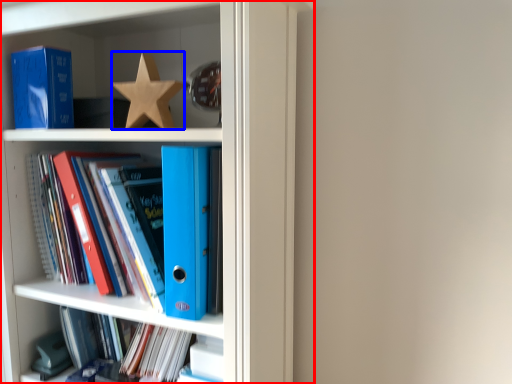
Question: Which of the following is the farthest to the observer, bookcase (highlighted by a red box) or star (highlighted by a blue box)?

Choices:
 (A) bookcase
 (B) star

Answer: (B)